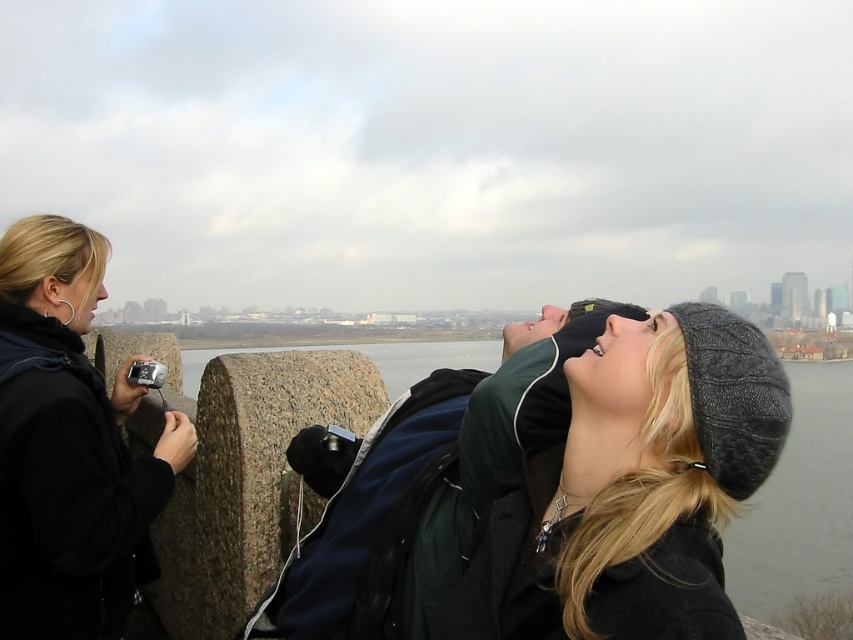
You are a photographer trying to capture a photo of two people. The dark gray knit hat at upper right is worn by the person on the right, and the black fabric camera at left is being held by the person on the left. If the minimum focus distance for your camera is 50 feet, will you be able to take a clear photo of both individuals?

The dark gray knit hat at upper right is 56.04 feet from the black fabric camera at left, which exceeds the minimum focus distance of 50 feet. Therefore, the camera can focus clearly on both individuals, so yes, you can take a clear photo of both.

Based on the coordinates provided, can you determine the position of the dark green jacket at center relative to the stone barrier?

The dark green jacket at center is located at coordinates point (419, 488), which places it near the stone barrier since the person wearing it is leaning against it.

In the scene shown: You are trying to decide which item to pack for a trip. You have space for either the dark gray knit hat at upper right or the dark green jacket at center. Based on their sizes, which item takes up less space?

The dark gray knit hat at upper right is narrower than the dark green jacket at center, so it takes up less space.